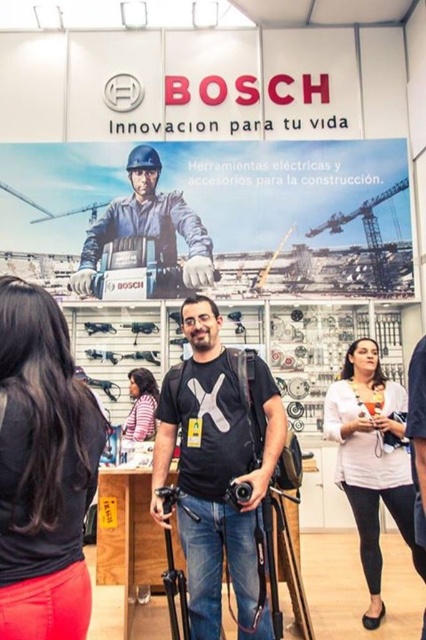
In the scene shown: You are standing in front of the Bosch trade show booth. You need to locate the matte plastic poster at upper center. Where should you look relative to the Bosch logo displayed on the backdrop?

The matte plastic poster at upper center is located at coordinates 0.336 on the x axis and 0.502 on the y axis relative to the Bosch logo displayed on the backdrop.

You are a photographer at the trade show and need to capture a photo of the Bosch logo and slogan on the backdrop. You notice the pink fabric shirt at lower left and the black plastic video camera at center. Which object is closer to the backdrop where the logo is displayed?

The pink fabric shirt at lower left is closer to the backdrop where the Bosch logo is displayed because it is located below the black plastic video camera at center, which would place it nearer to the backdrop compared to the camera.

Based on the photo, you are a construction worker attending a trade show and see the matte black helmet at upper center and the black plastic video camera at center. Which object is closer to you?

The matte black helmet at upper center is closer to you because it is further to the viewer than the black plastic video camera at center.